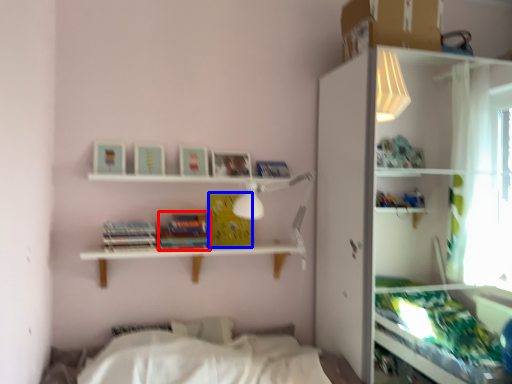
Question: Which object is further to the camera taking this photo, paperback book (highlighted by a red box) or paperback book (highlighted by a blue box)?

Choices:
 (A) paperback book
 (B) paperback book

Answer: (B)